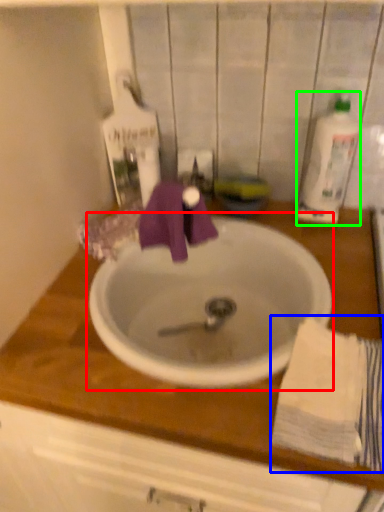
Question: Estimate the real-world distances between objects in this image. Which object is farther from sink (highlighted by a red box), bath towel (highlighted by a blue box) or cleaning product (highlighted by a green box)?

Choices:
 (A) bath towel
 (B) cleaning product

Answer: (B)